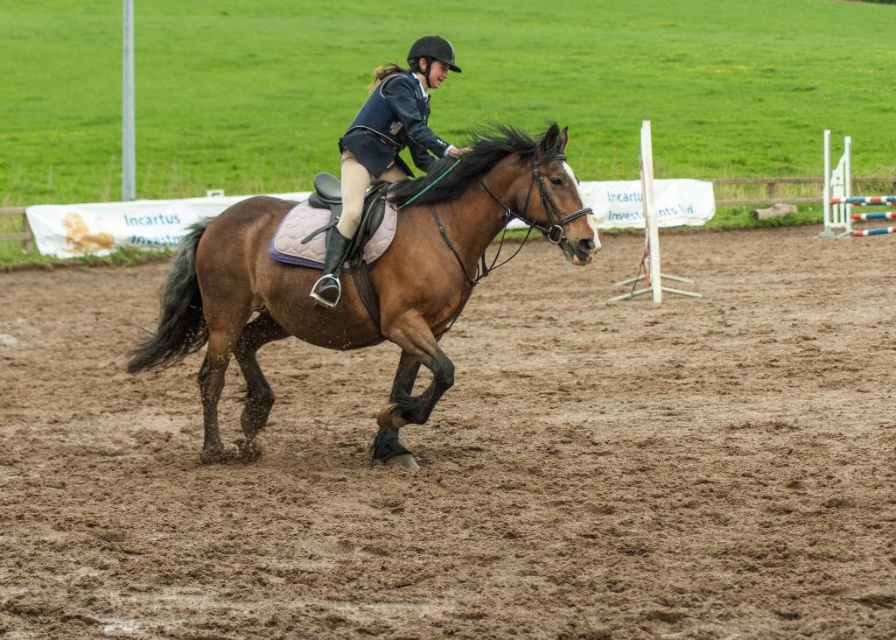
You are a photographer standing at the edge of the arena and want to capture a photo of the brown sandy dirt at center and the white plastic hurdle at upper right. Which object will appear larger in your photo?

The brown sandy dirt at center will appear larger in the photo because it is closer to the viewer than the white plastic hurdle at upper right.

You are a photographer positioned at the edge of the arena. You want to capture a photo of the brown glossy horse at center and the white plastic hurdle at upper right in the same frame. Based on their positions, which object should you adjust your camera to focus on first to ensure both are in the shot?

The brown glossy horse at center is to the left of the white plastic hurdle at upper right. To capture both in the same frame, focus on the brown glossy horse at center first since it is closer to your position at the edge of the arena, allowing you to pan towards the hurdle at upper right while keeping both in view.